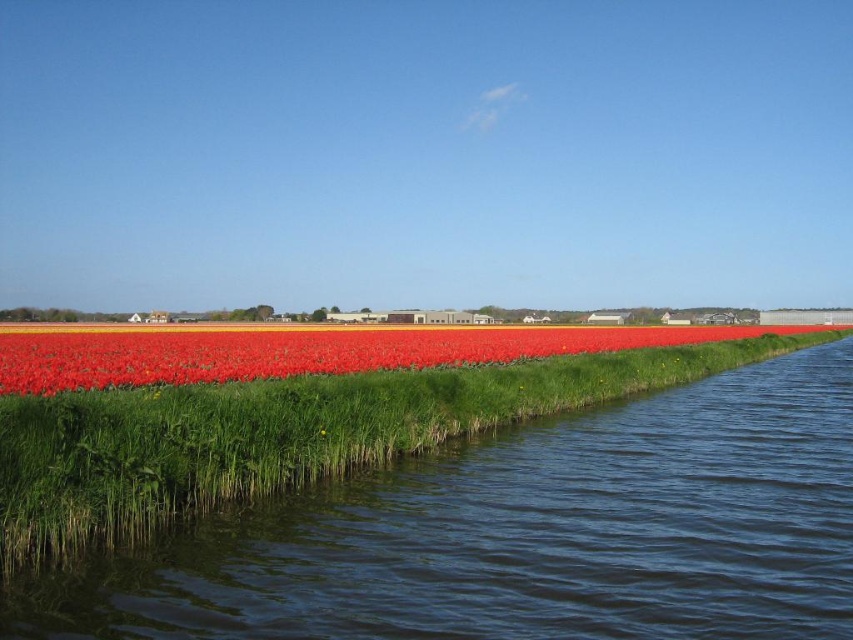
Does dark blue water at lower center have a smaller size compared to bright red petals at center?

Yes.

Does dark blue water at lower center lie in front of bright red petals at center?

Yes.

Image resolution: width=853 pixels, height=640 pixels. Find the location of `dark blue water at lower center`. dark blue water at lower center is located at coordinates pos(521,532).